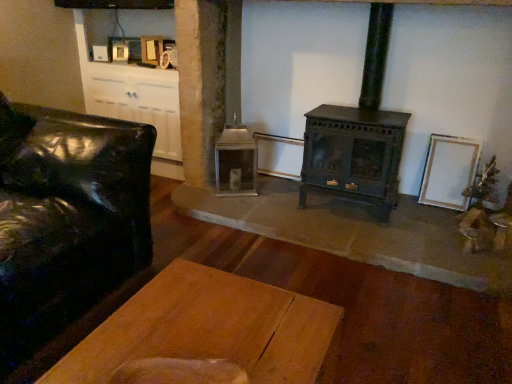
The height and width of the screenshot is (384, 512). In order to click on wooden plank table at center in this screenshot , I will do `click(208, 328)`.

Find the location of a particular element. This screenshot has height=384, width=512. green matte wood burning stove at center is located at coordinates (358, 135).

I want to click on table below the white matte picture frame at right (from the image's perspective), so tap(208, 328).

How many degrees apart are the facing directions of white matte picture frame at right and wooden plank table at center?

85.5 degrees separate the facing orientations of white matte picture frame at right and wooden plank table at center.

Is white matte picture frame at right facing towards wooden plank table at center?

Yes.

Is white matte picture frame at right completely or partially outside of wooden plank table at center?

Yes, white matte picture frame at right is outside of wooden plank table at center.

Is wooden plank table at center next to green matte wood burning stove at center?

wooden plank table at center is not next to green matte wood burning stove at center, and they're not touching.

Is wooden plank table at center wider than green matte wood burning stove at center?

Yes.

What's the angular difference between black leather couch at left and green matte wood burning stove at center's facing directions?

88.3 degrees.

Between black leather couch at left and green matte wood burning stove at center, which one appears on the right side from the viewer's perspective?

From the viewer's perspective, green matte wood burning stove at center appears more on the right side.

You are a GUI agent. You are given a task and a screenshot of the screen. Output one action in this format:
    pyautogui.click(x=<x>, y=<y>)
    Task: Click on the wood burning stove above the black leather couch at left (from the image's perspective)
    
    Given the screenshot: What is the action you would take?
    pyautogui.click(x=358, y=135)

From a real-world perspective, which object rests below the other?

black leather couch at left.

Find the location of a particular element. This screenshot has height=384, width=512. wood burning stove in front of the white matte picture frame at right is located at coordinates (358, 135).

Considering the relative sizes of green matte wood burning stove at center and white matte picture frame at right in the image provided, is green matte wood burning stove at center taller than white matte picture frame at right?

Yes.

Can we say green matte wood burning stove at center lies outside white matte picture frame at right?

Yes, green matte wood burning stove at center is outside of white matte picture frame at right.

From a real-world perspective, is green matte wood burning stove at center positioned above or below white matte picture frame at right?

From a real-world perspective, green matte wood burning stove at center is physically above white matte picture frame at right.

Is green matte wood burning stove at center next to wooden plank table at center and touching it?

No, green matte wood burning stove at center is not making contact with wooden plank table at center.

From a real-world perspective, is green matte wood burning stove at center over wooden plank table at center?

Yes.

Which is behind, point (393, 125) or point (138, 298)?

The point (393, 125) is more distant.

You are a GUI agent. You are given a task and a screenshot of the screen. Output one action in this format:
    pyautogui.click(x=<x>, y=<y>)
    Task: Click on the table below the green matte wood burning stove at center (from the image's perspective)
    This screenshot has height=384, width=512.
    Given the screenshot: What is the action you would take?
    pyautogui.click(x=208, y=328)

Choose the correct answer: Is white matte picture frame at right inside black leather couch at left or outside it?

white matte picture frame at right lies outside black leather couch at left.

Is black leather couch at left at the back of white matte picture frame at right?

white matte picture frame at right is not turned away from black leather couch at left.

What's the angular difference between white matte picture frame at right and black leather couch at left's facing directions?

94.5 degrees separate the facing orientations of white matte picture frame at right and black leather couch at left.

Is white matte picture frame at right taller or shorter than black leather couch at left?

Clearly, white matte picture frame at right is shorter compared to black leather couch at left.

From a real-world perspective, is green matte wood burning stove at center positioned above or below black leather couch at left?

green matte wood burning stove at center is above black leather couch at left.

Is black leather couch at left completely or partially inside green matte wood burning stove at center?

No, green matte wood burning stove at center does not contain black leather couch at left.

Considering the points (309, 142) and (83, 221), which point is behind, point (309, 142) or point (83, 221)?

Positioned behind is point (309, 142).

Locate an element on the screen. This screenshot has width=512, height=384. table located underneath the white matte picture frame at right (from a real-world perspective) is located at coordinates 208,328.

Locate an element on the screen. wood burning stove above the wooden plank table at center (from a real-world perspective) is located at coordinates (358, 135).

Estimate the real-world distances between objects in this image. Which object is further from wooden plank table at center, green matte wood burning stove at center or black leather couch at left?

The object further to wooden plank table at center is green matte wood burning stove at center.

From the picture: Which object lies further to the anchor point white matte picture frame at right, black leather couch at left or green matte wood burning stove at center?

Result: The object further to white matte picture frame at right is black leather couch at left.

Based on the photo, which object lies nearer to the anchor point white matte picture frame at right, green matte wood burning stove at center or black leather couch at left?

green matte wood burning stove at center is closer to white matte picture frame at right.

Looking at the image, which one is located further to black leather couch at left, wooden plank table at center or green matte wood burning stove at center?

Based on the image, green matte wood burning stove at center appears to be further to black leather couch at left.

Considering their positions, is white matte picture frame at right positioned closer to wooden plank table at center than black leather couch at left?

black leather couch at left.

Based on their spatial positions, is green matte wood burning stove at center or wooden plank table at center further from black leather couch at left?

Based on the image, green matte wood burning stove at center appears to be further to black leather couch at left.

When comparing their distances from white matte picture frame at right, does black leather couch at left or wooden plank table at center seem further?

black leather couch at left is positioned further to the anchor white matte picture frame at right.

Considering their positions, is white matte picture frame at right positioned closer to black leather couch at left than wooden plank table at center?

wooden plank table at center lies closer to black leather couch at left than the other object.

Find the location of a particular element. This screenshot has width=512, height=384. wood burning stove between black leather couch at left and white matte picture frame at right is located at coordinates (358, 135).

Find the location of a particular element. Image resolution: width=512 pixels, height=384 pixels. table situated between black leather couch at left and white matte picture frame at right from left to right is located at coordinates (208, 328).

The image size is (512, 384). Identify the location of table between black leather couch at left and green matte wood burning stove at center from left to right. (208, 328).

At what (x,y) coordinates should I click in order to perform the action: click on wood burning stove positioned between wooden plank table at center and white matte picture frame at right from near to far. Please return your answer as a coordinate pair (x, y). This screenshot has height=384, width=512. Looking at the image, I should click on (358, 135).